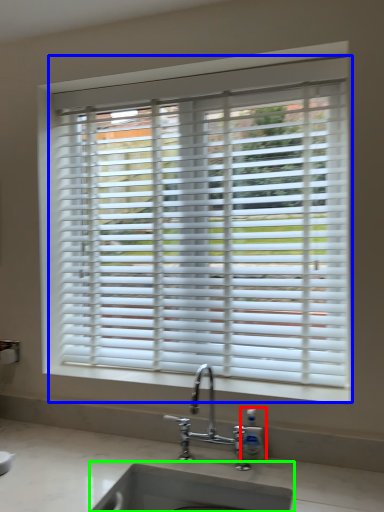
Question: Considering the real-world distances, which object is farthest from soap dispenser (highlighted by a red box)? window blind (highlighted by a blue box) or sink (highlighted by a green box)?

Choices:
 (A) window blind
 (B) sink

Answer: (A)